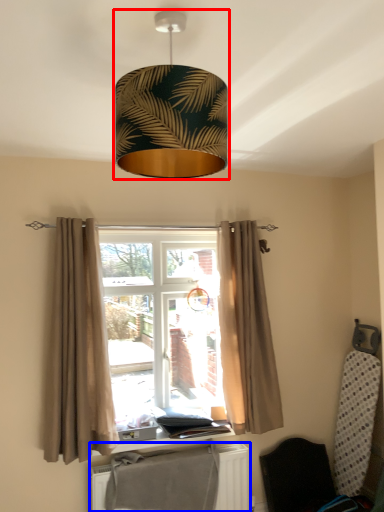
Question: Which object is further to the camera taking this photo, lamp (highlighted by a red box) or radiator (highlighted by a blue box)?

Choices:
 (A) lamp
 (B) radiator

Answer: (B)